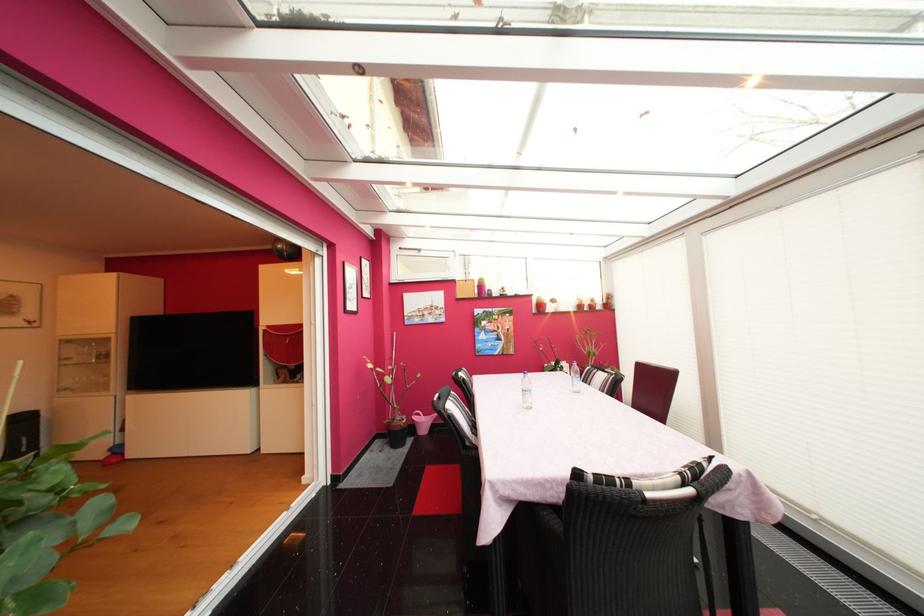
Which object does [421,422] point to?

It corresponds to the pink watering can in the image.